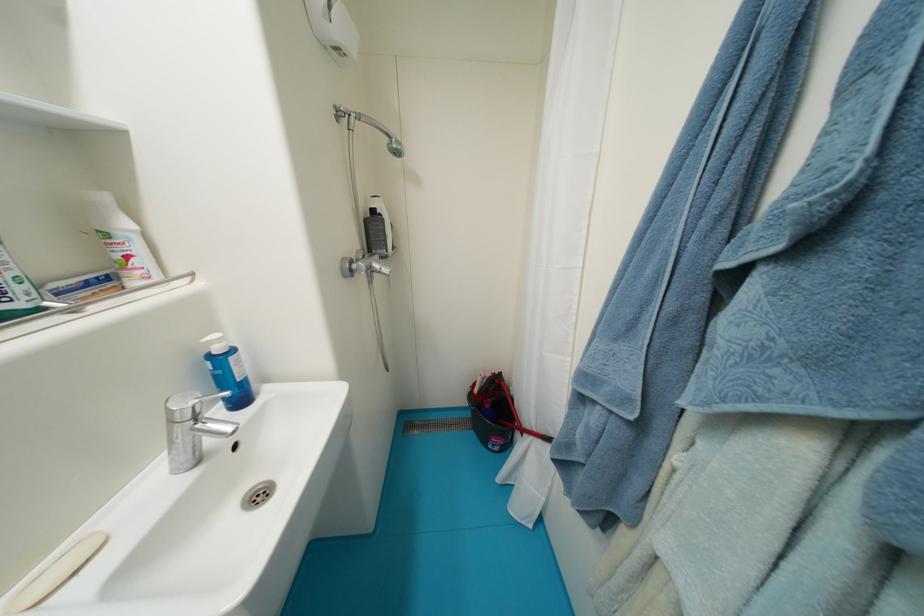
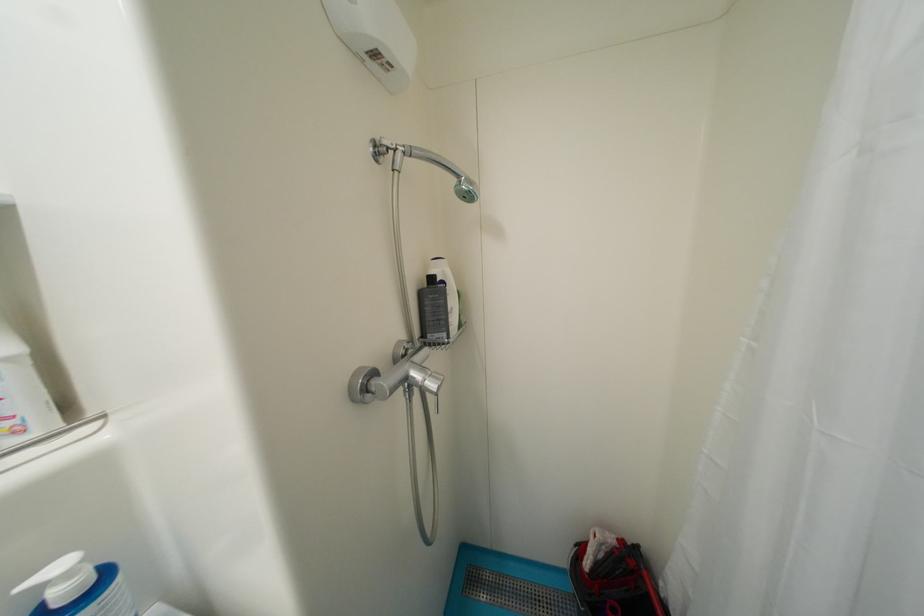
Locate, in the second image, the point that corresponds to point (405, 156) in the first image.

(476, 199)